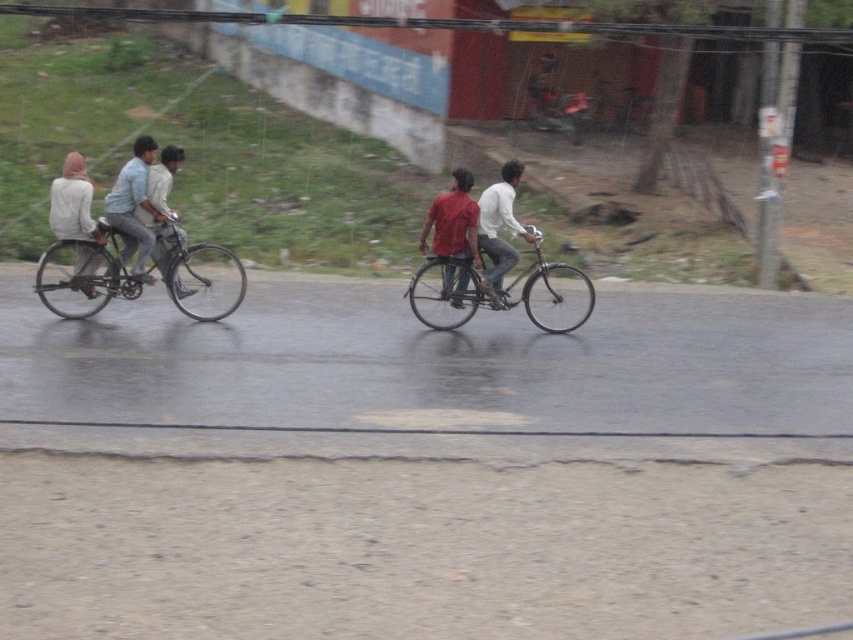
You are a photographer trying to capture both the shiny metallic bicycle at left and the metallic silver bicycle at center in a single shot. Since you want to include the red structure in the background, which bicycle should you position closer to the camera to ensure both bikes and the red structure are in frame?

You should position the shiny metallic bicycle at left closer to the camera because it is on the left side of the metallic silver bicycle at center, allowing both bicycles to be captured along with the red structure in the background.

In the scene shown: You are a delivery person who needs to pass between the shiny metallic bicycle at left and the metallic silver bicycle at center. Your delivery cart is 2 meters wide. Can you safely navigate through the space between them?

The distance between the shiny metallic bicycle at left and the metallic silver bicycle at center is 2.26 meters. Since your delivery cart is 2 meters wide, there is enough space to safely navigate through the gap between them.

You are standing at the point with coordinates (201, 276). There is a shiny metallic bicycle at left. What is the direction of the bicycle relative to your current position?

The shiny metallic bicycle at left is located to the left of your current position at point (201, 276).